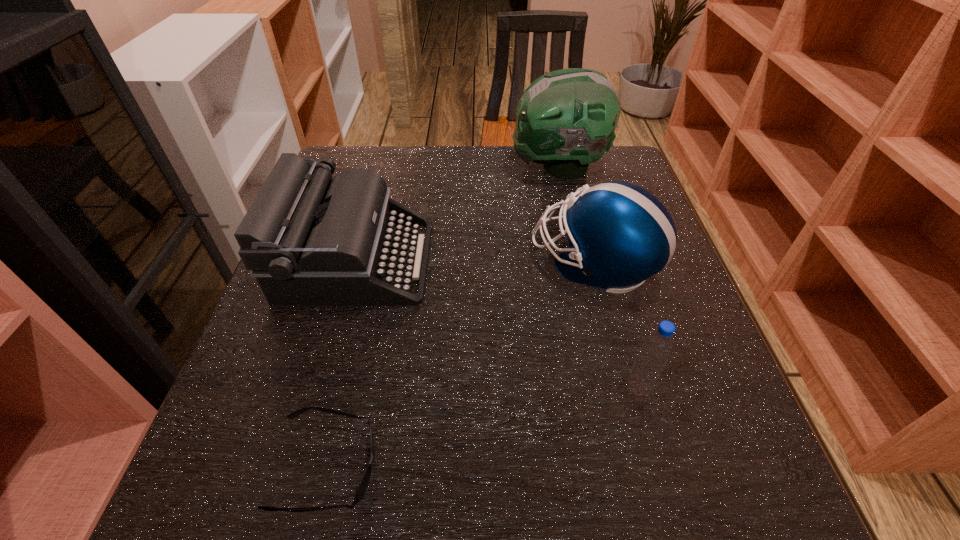
The image size is (960, 540). What are the coordinates of `free space between the second nearest object and the sunglasses` in the screenshot? It's located at (483, 427).

Locate an element on the screen. This screenshot has width=960, height=540. unoccupied position between the typewriter and the fourth farthest object is located at coordinates pos(498,324).

What are the coordinates of `free space between the sunglasses and the shorter football helmet` in the screenshot? It's located at (461, 365).

Locate an element on the screen. The width and height of the screenshot is (960, 540). free space between the shortest object and the water bottle is located at coordinates (483, 427).

Identify the location of free space that is in between the shorter football helmet and the water bottle. (616, 326).

Find the location of a particular element. object that is the second closest to the typewriter is located at coordinates (566, 119).

Where is `object identified as the fourth closest to the sunglasses`? The image size is (960, 540). object identified as the fourth closest to the sunglasses is located at coordinates (566, 119).

The image size is (960, 540). Identify the location of free spot that satisfies the following two spatial constraints: 1. on the back side of the water bottle; 2. on the typing side of the typewriter. (603, 260).

The width and height of the screenshot is (960, 540). I want to click on free location that satisfies the following two spatial constraints: 1. on the visor of the farther football helmet; 2. on the back side of the water bottle, so click(608, 387).